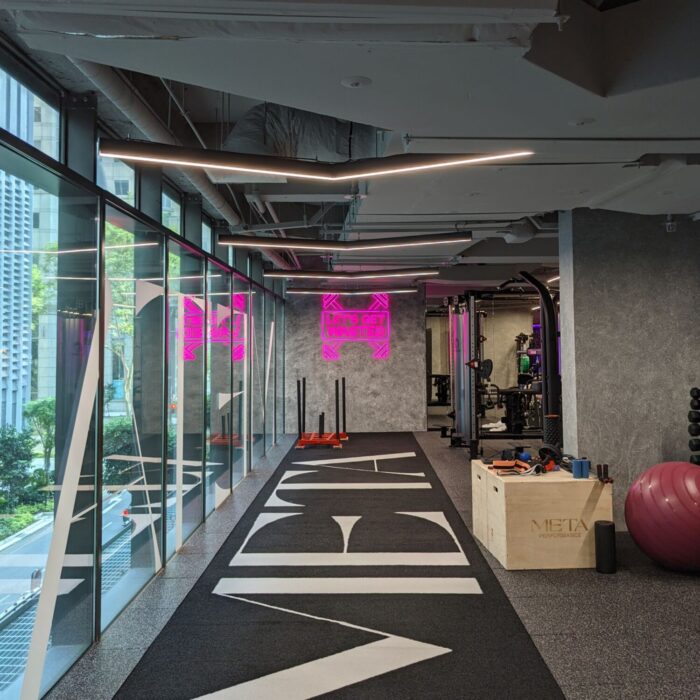
Identify the location of neon pink sign. This screenshot has width=700, height=700. (353, 325).